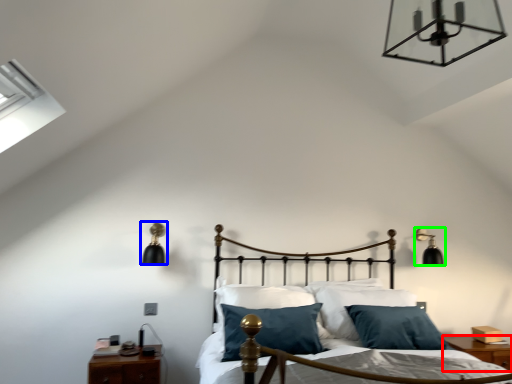
Question: Based on their relative distances, which object is nearer to nightstand (highlighted by a red box)? Choose from lamp (highlighted by a blue box) and lamp (highlighted by a green box).

Choices:
 (A) lamp
 (B) lamp

Answer: (B)